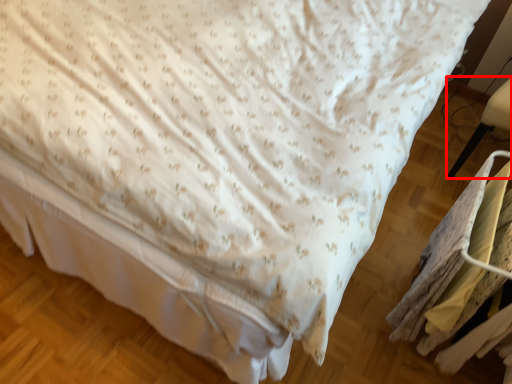
Question: Considering the relative positions of furniture (annotated by the red box) and laundry in the image provided, where is furniture (annotated by the red box) located with respect to the staircase?

Choices:
 (A) right
 (B) left

Answer: (A)